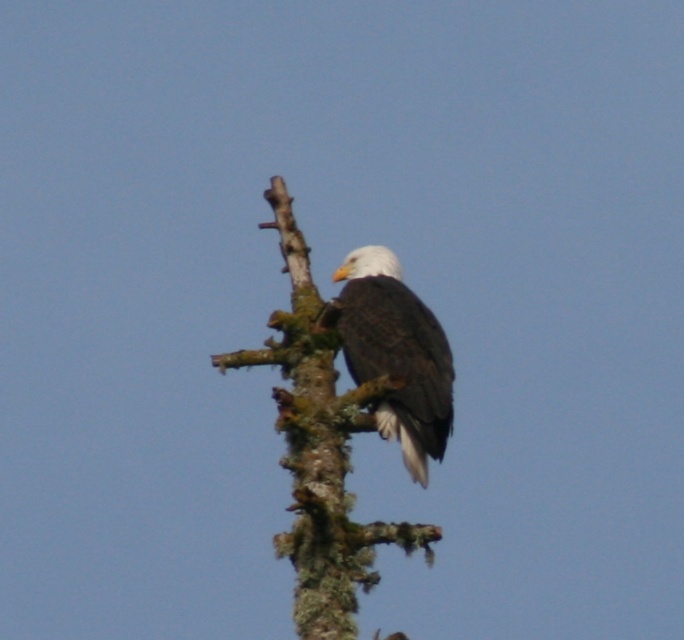
You are an ornithologist observing a bald eagle in its natural habitat. You notice a specific point at coordinates point (319, 449). Based on the scene, what does this point likely represent?

The point (319, 449) corresponds to the green mossy branch at upper center where the bald eagle is perched.